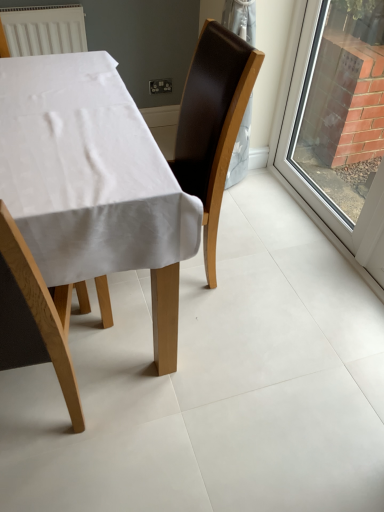
The height and width of the screenshot is (512, 384). I want to click on free spot to the right of wooden chair at lower left, the first chair viewed from the front, so click(x=128, y=423).